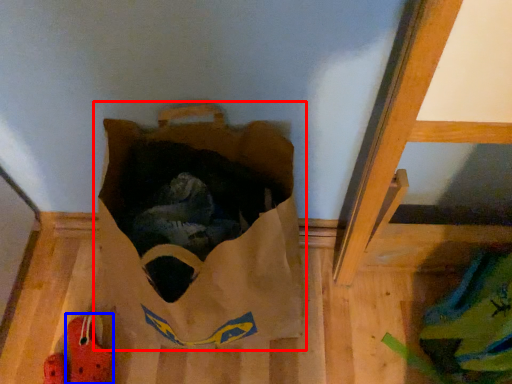
Question: Which point is closer to the camera, grocery bag (highlighted by a red box) or footwear (highlighted by a blue box)?

Choices:
 (A) grocery bag
 (B) footwear

Answer: (A)